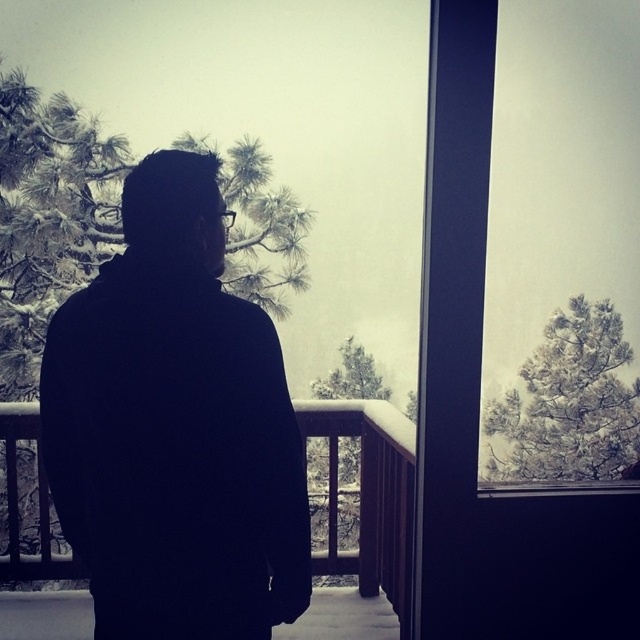
Question: Estimate the real-world distances between objects in this image. Which object is farther from the black matte jacket at center?

Choices:
 (A) wooden at left
 (B) snow-covered pine tree at upper center

Answer: (B)

Question: Is black matte jacket at center to the right of snow-covered pine tree at upper center from the viewer's perspective?

Choices:
 (A) yes
 (B) no

Answer: (B)

Question: Is snow-covered pine tree at upper center below wooden at left?

Choices:
 (A) no
 (B) yes

Answer: (A)

Question: Which point is closer to the camera taking this photo?

Choices:
 (A) (608, 392)
 (B) (392, 476)
 (C) (237, 470)

Answer: (C)

Question: Which object is the farthest from the black matte jacket at center?

Choices:
 (A) wooden at left
 (B) snow-covered pine tree at upper center

Answer: (B)

Question: Can you confirm if black matte jacket at center is positioned below wooden at left?

Choices:
 (A) yes
 (B) no

Answer: (B)